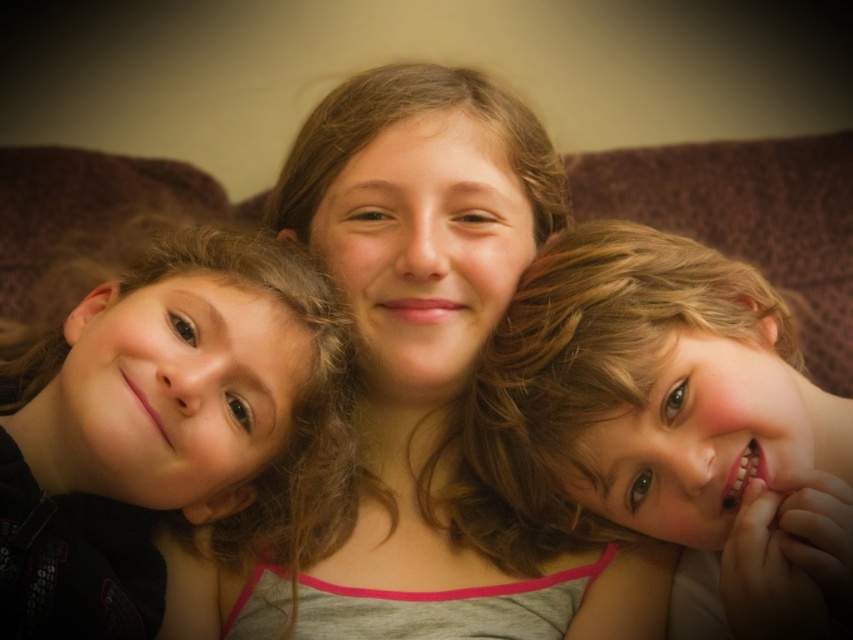
Question: Based on their relative distances, which object is farther from the smooth skin child at center?

Choices:
 (A) dark brown hair at left
 (B) smooth skin face at center
 (C) brown fabric couch at center

Answer: (C)

Question: Which point is farther from the camera taking this photo?

Choices:
 (A) (482, 83)
 (B) (239, 481)
 (C) (786, 532)

Answer: (A)

Question: Considering the real-world distances, which object is closest to the smooth skin face at center?

Choices:
 (A) smooth skin child at center
 (B) brown fabric couch at center
 (C) dark brown hair at left

Answer: (A)

Question: Can you confirm if smooth skin face at center is thinner than brown fabric couch at center?

Choices:
 (A) no
 (B) yes

Answer: (B)

Question: Can you confirm if smooth skin child at center is bigger than brown fabric couch at center?

Choices:
 (A) yes
 (B) no

Answer: (B)

Question: In this image, where is smooth skin face at center located relative to dark brown hair at left?

Choices:
 (A) above
 (B) below

Answer: (A)